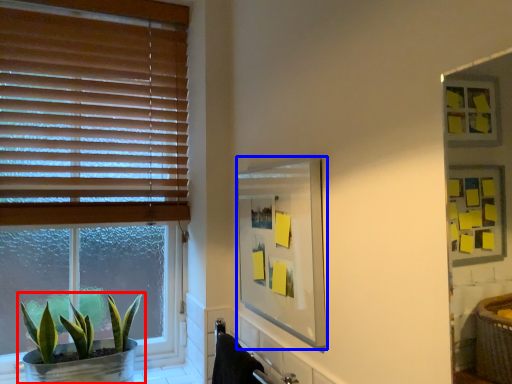
Question: Which of the following is the closest to the observer, houseplant (highlighted by a red box) or mirror (highlighted by a blue box)?

Choices:
 (A) houseplant
 (B) mirror

Answer: (B)